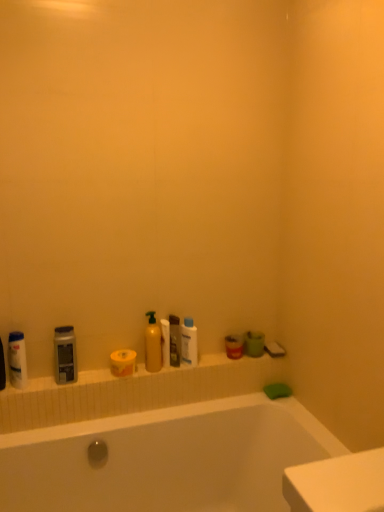
Question: Is translucent plastic bottle at center, which ranks as the 3th cleaning product in left-to-right order, taller or shorter than yellow matte toilet paper at center, acting as the 1th toilet paper starting from the left?

Choices:
 (A) tall
 (B) short

Answer: (A)

Question: Is point (175, 332) closer or farther from the camera than point (127, 373)?

Choices:
 (A) closer
 (B) farther

Answer: (A)

Question: Estimate the real-world distances between objects in this image. Which object is closer to the white matte bottle at left, which ranks as the 2th mouthwash in right-to-left order?

Choices:
 (A) matte plastic mouthwash at center, the 2th mouthwash when ordered from left to right
 (B) translucent plastic bottle at center, which ranks as the 3th cleaning product in left-to-right order
 (C) yellow matte toilet paper at center, acting as the 1th toilet paper starting from the left
 (D) matte yellow bottle at center, which is counted as the 2th cleaning product, starting from the left
 (E) matte gray bottle at left, which is counted as the first cleaning product, starting from the left

Answer: (E)

Question: Which object is positioned farthest from the white matte bottle at left, positioned as the first mouthwash in left-to-right order?

Choices:
 (A) white matte toilet paper at center, which is the 1th toilet paper from right to left
 (B) matte gray bottle at left, which ranks as the third cleaning product in right-to-left order
 (C) matte yellow bottle at center, which is counted as the 2th cleaning product, starting from the left
 (D) white glossy bottle at center
 (E) matte plastic mouthwash at center, the first mouthwash in the right-to-left sequence

Answer: (E)